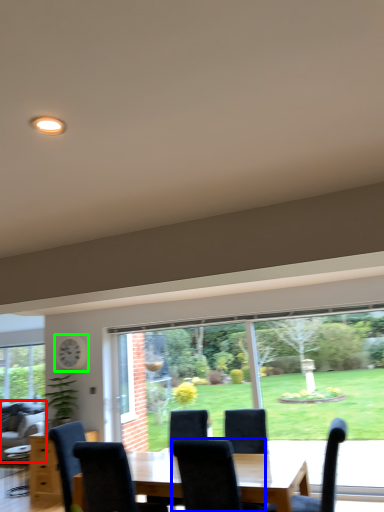
Question: Which is nearer to the couch (highlighted by a red box)? chair (highlighted by a blue box) or clock (highlighted by a green box).

Choices:
 (A) chair
 (B) clock

Answer: (B)